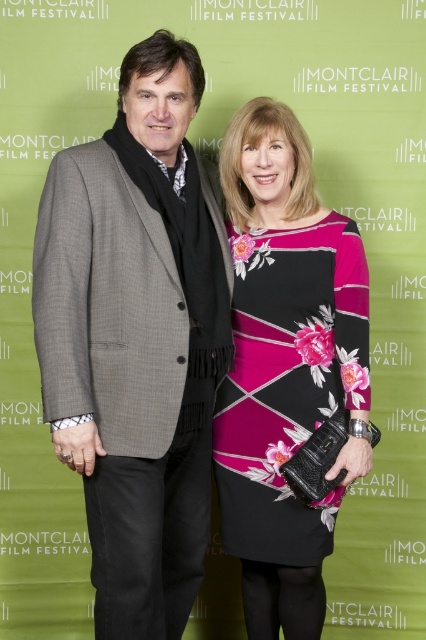
Based on the scene description, can you determine the exact coordinates of the gray wool blazer at center?

The gray wool blazer at center is located at coordinates point (137, 339).